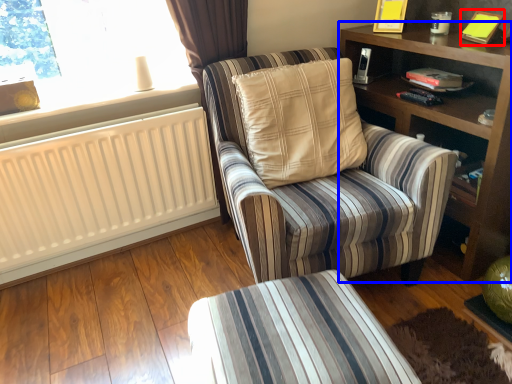
Question: Among these objects, which one is farthest to the camera, book (highlighted by a red box) or shelf (highlighted by a blue box)?

Choices:
 (A) book
 (B) shelf

Answer: (A)